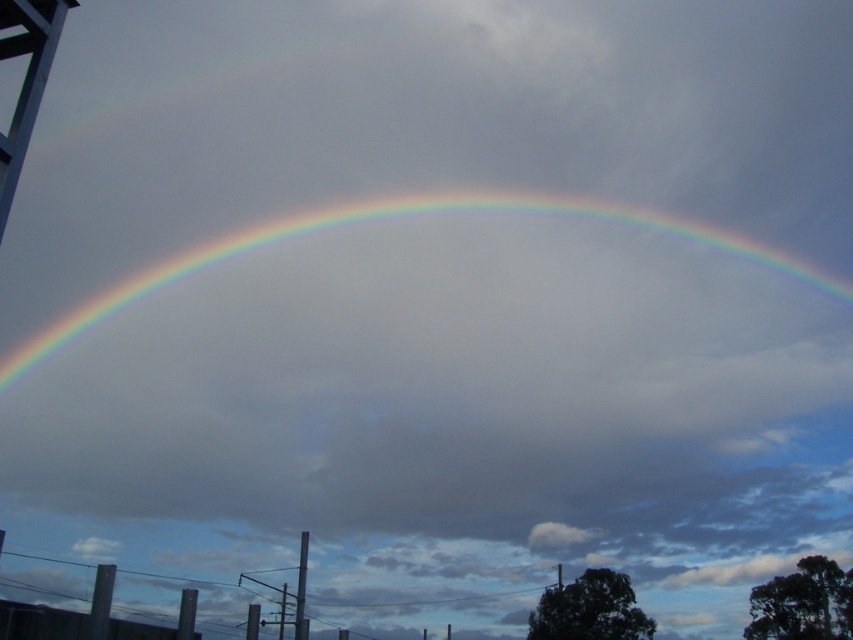
Is rainbow at center below white matte water tower at upper left?

No.

Between point (305, 225) and point (32, 104), which one is positioned in front?

Positioned in front is point (32, 104).

Where is `rainbow at center`? rainbow at center is located at coordinates (392, 218).